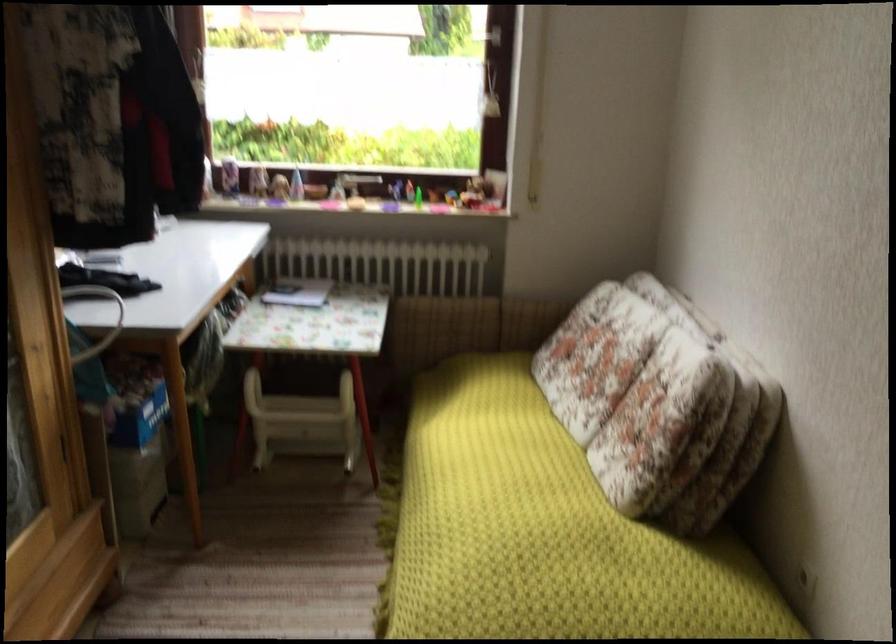
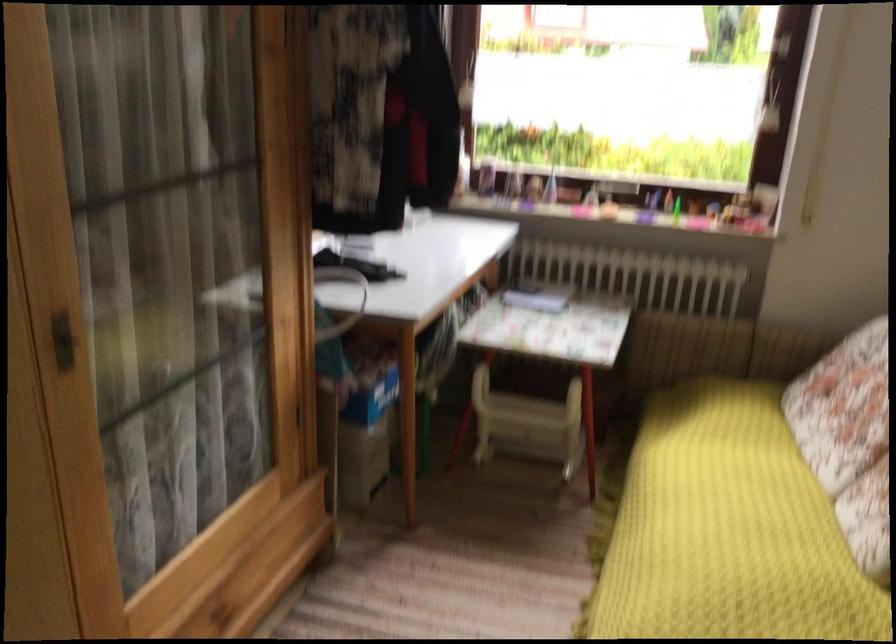
In the second image, find the point that corresponds to point (586, 391) in the first image.

(849, 439)